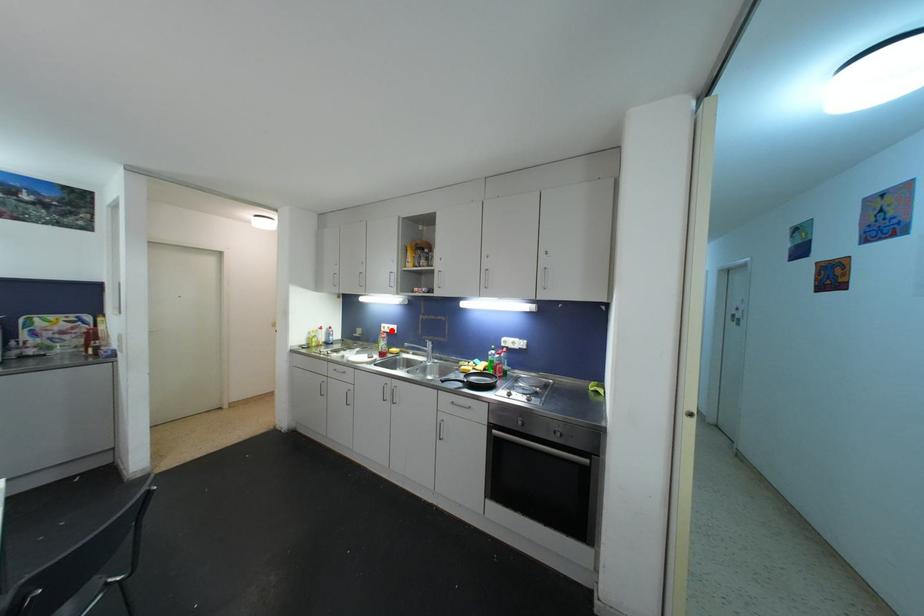
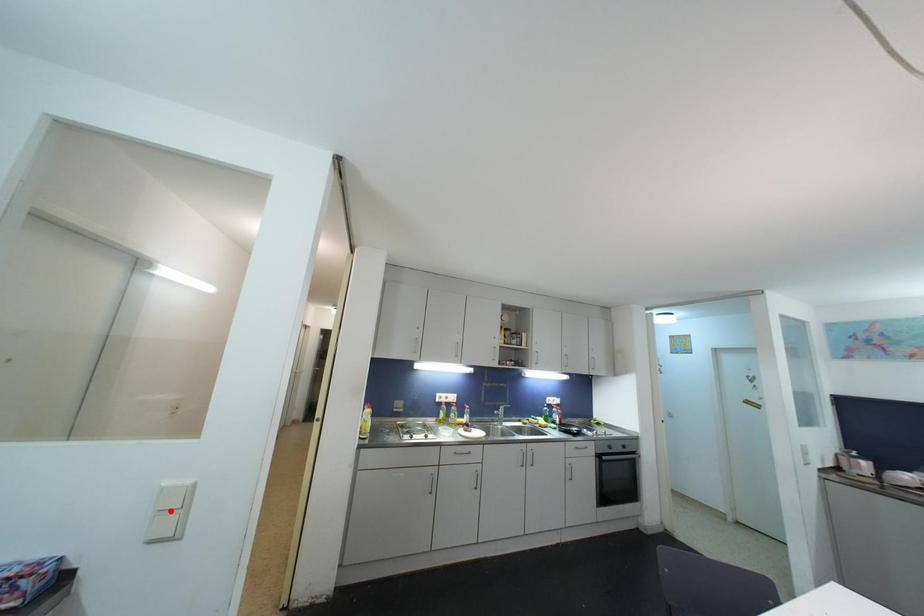
I am providing you with two images of the same scene from different viewpoints. A red point is marked on the first image and another point is marked on the second image. Do the highlighted points in image1 and image2 indicate the same real-world spot?

No